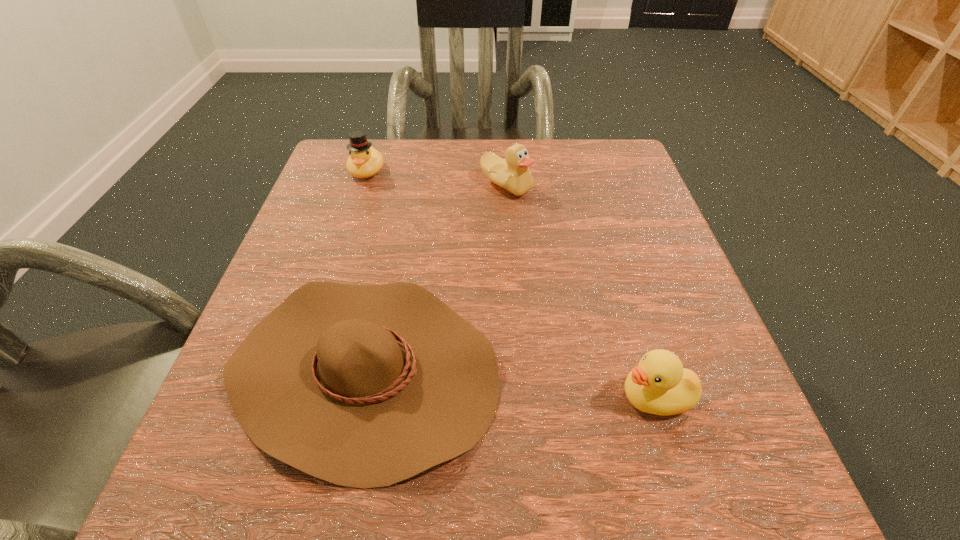
The height and width of the screenshot is (540, 960). Identify the location of free space that satisfies the following two spatial constraints: 1. on the front-facing side of the leftmost duck; 2. on the left side of the shortest object. (302, 369).

What are the coordinates of `vacant region that satisfies the following two spatial constraints: 1. on the front-facing side of the shortest object; 2. on the right side of the leftmost duck` in the screenshot? It's located at (302, 369).